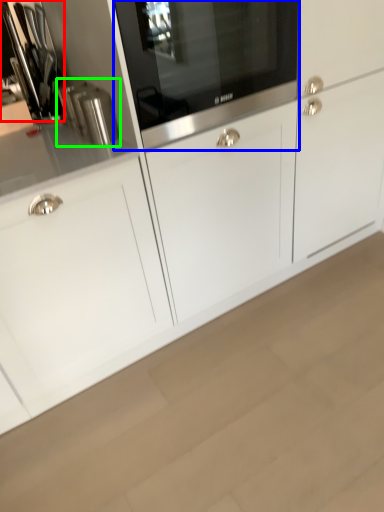
Question: Which object is the closest to the appliance (highlighted by a red box)? Choose among these: home appliance (highlighted by a blue box) or kitchen appliance (highlighted by a green box).

Choices:
 (A) home appliance
 (B) kitchen appliance

Answer: (B)